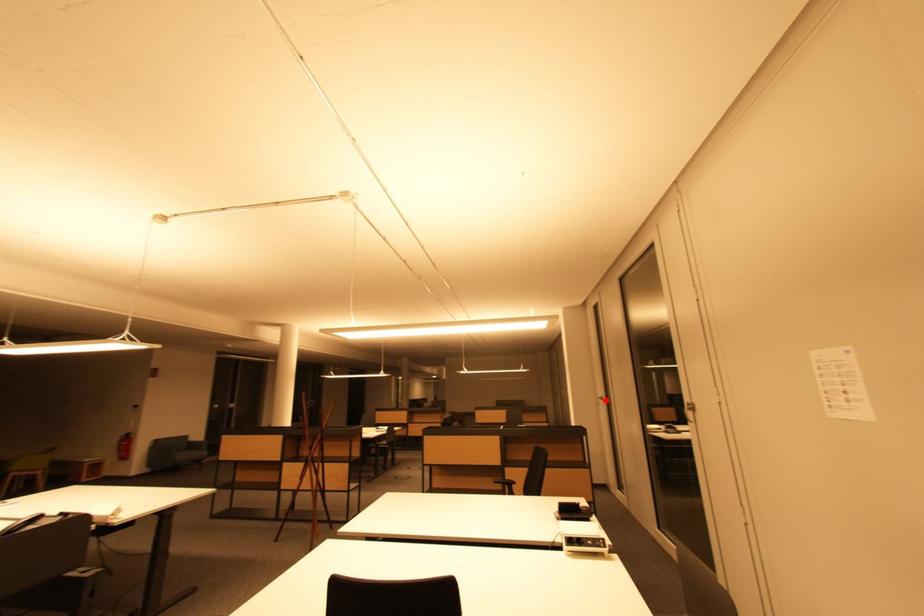
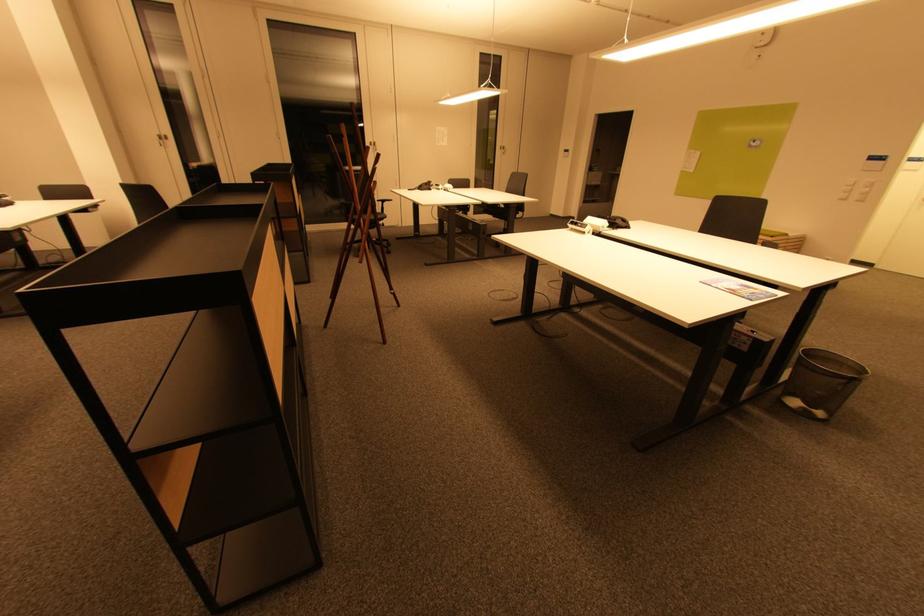
Find the pixel in the second image that matches the highlighted location in the first image.

(166, 140)